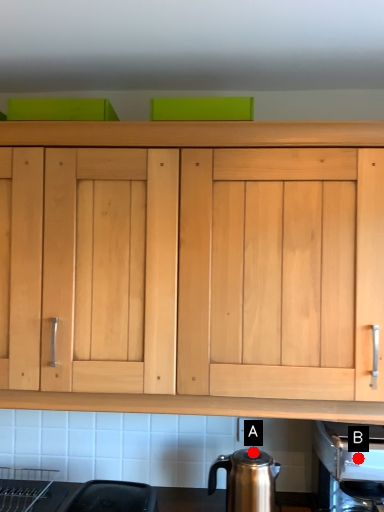
Question: Two points are circled on the image, labeled by A and B beside each circle. Which point is farther to the camera?

Choices:
 (A) A is further
 (B) B is further

Answer: (B)